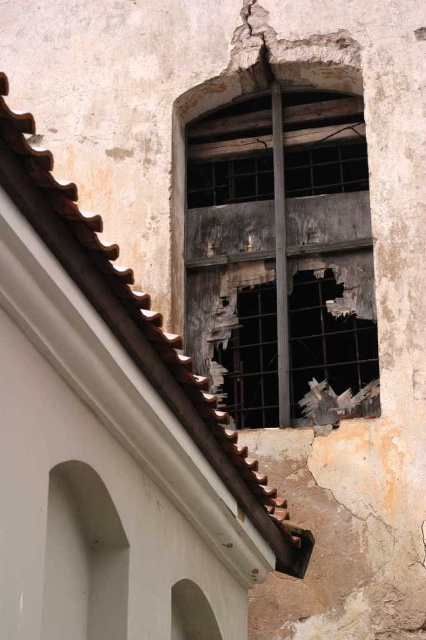
You are an architect analyzing the old building. You need to compare the widths of the rusty metal window at center and the smooth brown stone arch at lower left. Which one is wider?

The rusty metal window at center is wider than the smooth brown stone arch at lower left because its width surpasses the latter.